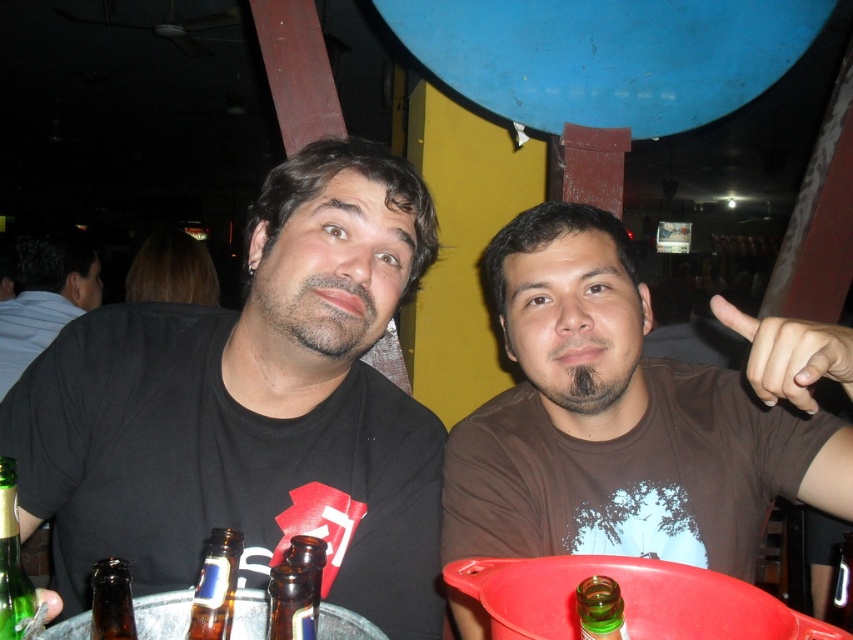
Does green glass bottle at lower left have a greater height compared to brown glass bottle at lower left?

Correct, green glass bottle at lower left is much taller as brown glass bottle at lower left.

Locate an element on the screen. green glass bottle at lower left is located at coordinates (12, 563).

Does brown matte shirt at center appear under translucent glass beer bottle at lower left?

No, brown matte shirt at center is not below translucent glass beer bottle at lower left.

Can you confirm if brown matte shirt at center is thinner than translucent glass beer bottle at lower left?

No.

Where is `brown matte shirt at center`? This screenshot has width=853, height=640. brown matte shirt at center is located at coordinates (633, 416).

Between point (399, 557) and point (540, 483), which one is positioned behind?

The point (540, 483) is more distant.

Is black matte shirt at left further to camera compared to brown matte shirt at center?

Yes.

Is point (383, 541) positioned after point (592, 493)?

No, (383, 541) is closer to viewer.

Identify the location of black matte shirt at left. The image size is (853, 640). (252, 408).